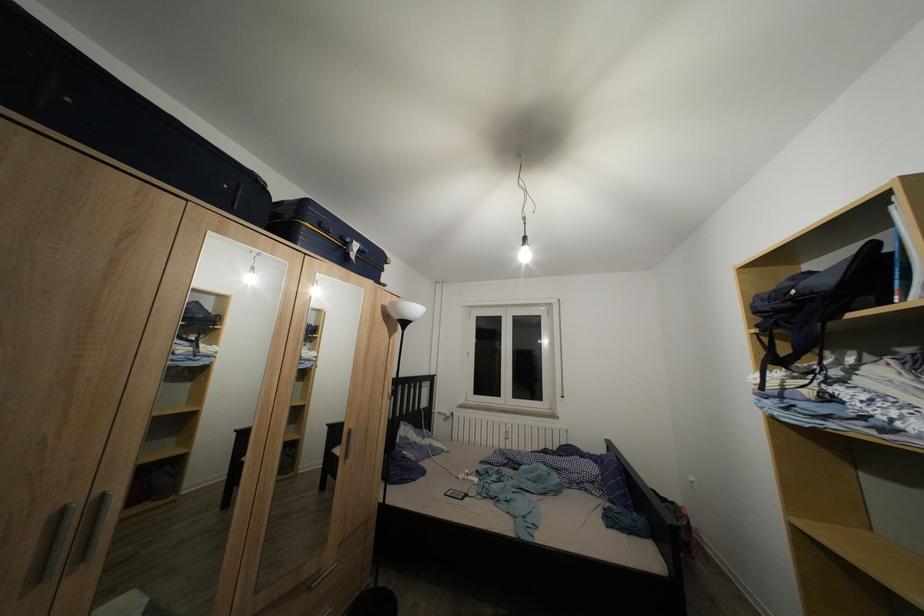
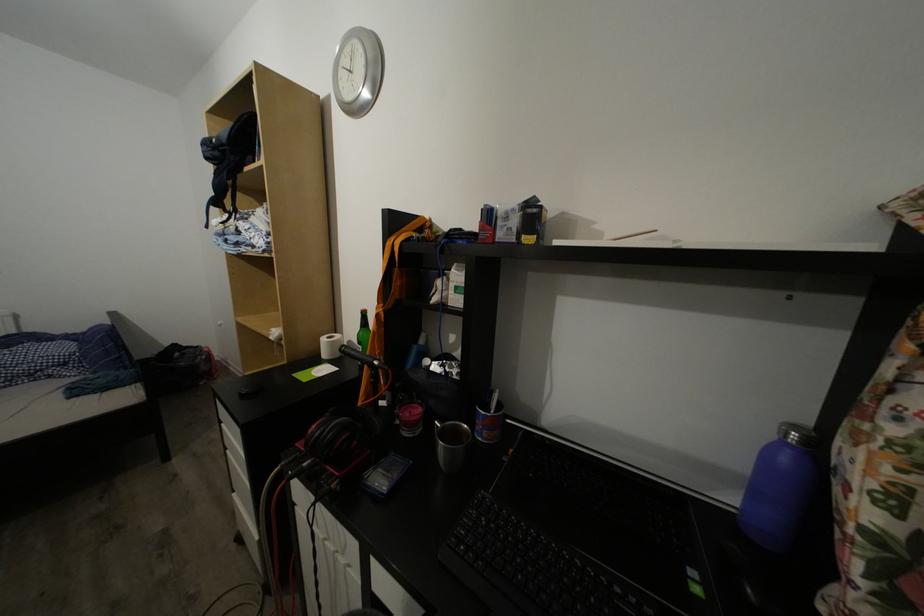
From the picture: First-person continuous shooting, in which direction is the camera rotating?

→ The rotation direction of the camera is right-down.